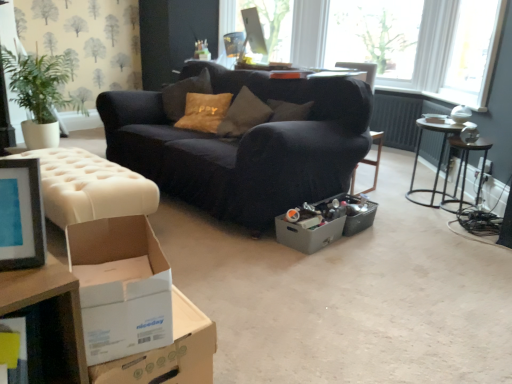
Question: Is transparent glass window at upper right shorter than white cardboard box at lower left, which is the second cardboard box in right-to-left order?

Choices:
 (A) yes
 (B) no

Answer: (B)

Question: Does transparent glass window at upper right appear on the right side of white cardboard box at lower left, which is the second cardboard box in right-to-left order?

Choices:
 (A) no
 (B) yes

Answer: (B)

Question: Is transparent glass window at upper right taller than white cardboard box at lower left, which is the second cardboard box in right-to-left order?

Choices:
 (A) no
 (B) yes

Answer: (B)

Question: From the image's perspective, is transparent glass window at upper right under white cardboard box at lower left, which is the second cardboard box in right-to-left order?

Choices:
 (A) no
 (B) yes

Answer: (A)

Question: Is transparent glass window at upper right outside of white cardboard box at lower left, positioned as the 3th cardboard box in back-to-front order?

Choices:
 (A) no
 (B) yes

Answer: (B)

Question: Is transparent glass window at upper right smaller than white cardboard box at lower left, the first cardboard box positioned from the front?

Choices:
 (A) yes
 (B) no

Answer: (B)

Question: From a real-world perspective, is white cardboard box at lower left, positioned as the 3th cardboard box in back-to-front order, on top of gray cardboard box at center, marked as the 3th cardboard box in a left-to-right arrangement?

Choices:
 (A) no
 (B) yes

Answer: (B)

Question: Is white cardboard box at lower left, positioned as the 3th cardboard box in back-to-front order, at the left side of gray cardboard box at center, which is the 1th cardboard box from back to front?

Choices:
 (A) yes
 (B) no

Answer: (A)

Question: From the image's perspective, is white cardboard box at lower left, which is the second cardboard box in right-to-left order, located beneath gray cardboard box at center, which is the 1th cardboard box from back to front?

Choices:
 (A) yes
 (B) no

Answer: (A)

Question: From the image's perspective, does white cardboard box at lower left, which is the second cardboard box in right-to-left order, appear higher than gray cardboard box at center, which appears as the first cardboard box when viewed from the right?

Choices:
 (A) no
 (B) yes

Answer: (A)

Question: Is white cardboard box at lower left, which is the second cardboard box in right-to-left order, positioned in front of gray cardboard box at center, marked as the 3th cardboard box in a left-to-right arrangement?

Choices:
 (A) yes
 (B) no

Answer: (A)

Question: Considering the relative positions of white cardboard box at lower left, positioned as the 3th cardboard box in back-to-front order, and gray cardboard box at center, which appears as the first cardboard box when viewed from the right, in the image provided, is white cardboard box at lower left, positioned as the 3th cardboard box in back-to-front order, to the right of gray cardboard box at center, which appears as the first cardboard box when viewed from the right, from the viewer's perspective?

Choices:
 (A) no
 (B) yes

Answer: (A)

Question: Is white glossy table at upper center, which appears as the 2th table when ordered from the bottom, to the left of white tufted ottoman at left from the viewer's perspective?

Choices:
 (A) no
 (B) yes

Answer: (A)